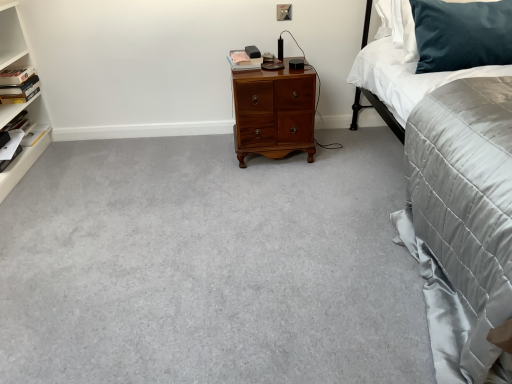
Question: Is dark blue velvet pillow at upper right positioned behind gray carpet at center?

Choices:
 (A) no
 (B) yes

Answer: (B)

Question: Is dark blue velvet pillow at upper right facing away from gray carpet at center?

Choices:
 (A) yes
 (B) no

Answer: (B)

Question: Can you confirm if dark blue velvet pillow at upper right is positioned to the right of gray carpet at center?

Choices:
 (A) yes
 (B) no

Answer: (A)

Question: From the image's perspective, is dark blue velvet pillow at upper right beneath gray carpet at center?

Choices:
 (A) no
 (B) yes

Answer: (A)

Question: Is dark blue velvet pillow at upper right positioned in front of gray carpet at center?

Choices:
 (A) no
 (B) yes

Answer: (A)

Question: In the image, is shiny brown wooden nightstand at center on the left side or the right side of matte pink book at center, marked as the 3th book in a left-to-right arrangement?

Choices:
 (A) left
 (B) right

Answer: (B)

Question: Is shiny brown wooden nightstand at center situated inside matte pink book at center, placed as the third book when sorted from bottom to top, or outside?

Choices:
 (A) outside
 (B) inside

Answer: (A)

Question: Considering the positions of shiny brown wooden nightstand at center and matte pink book at center, placed as the third book when sorted from bottom to top, in the image, is shiny brown wooden nightstand at center wider or thinner than matte pink book at center, placed as the third book when sorted from bottom to top,?

Choices:
 (A) wide
 (B) thin

Answer: (A)

Question: From the image's perspective, is shiny brown wooden nightstand at center above or below matte pink book at center, which is counted as the 1th book, starting from the top?

Choices:
 (A) below
 (B) above

Answer: (A)

Question: Based on their positions, is white satin sheet at upper right located to the left or right of hardcover book at left, the third book when ordered from right to left?

Choices:
 (A) right
 (B) left

Answer: (A)

Question: Considering their positions, is white satin sheet at upper right located in front of or behind hardcover book at left, marked as the 2th book in a top-to-bottom arrangement?

Choices:
 (A) front
 (B) behind

Answer: (A)

Question: Which is correct: white satin sheet at upper right is inside hardcover book at left, the third book when ordered from right to left, or outside of it?

Choices:
 (A) inside
 (B) outside

Answer: (B)

Question: From the image's perspective, is white satin sheet at upper right positioned above or below hardcover book at left, marked as the 2th book in a top-to-bottom arrangement?

Choices:
 (A) below
 (B) above

Answer: (B)

Question: From the image's perspective, is matte pink book at center, placed as the third book when sorted from bottom to top, located above or below satin grey quilt at right?

Choices:
 (A) above
 (B) below

Answer: (A)

Question: Is point (250, 64) positioned closer to the camera than point (472, 142)?

Choices:
 (A) closer
 (B) farther

Answer: (B)